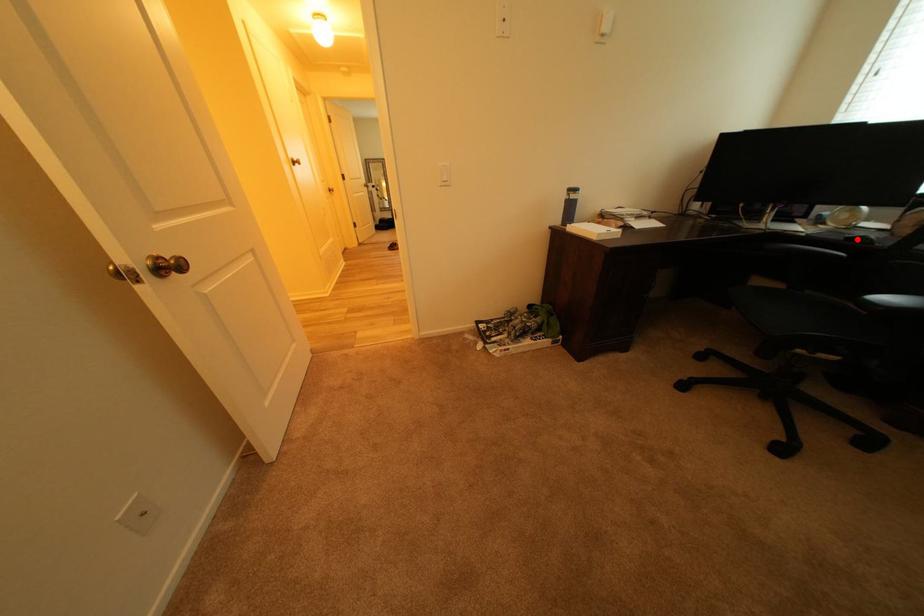
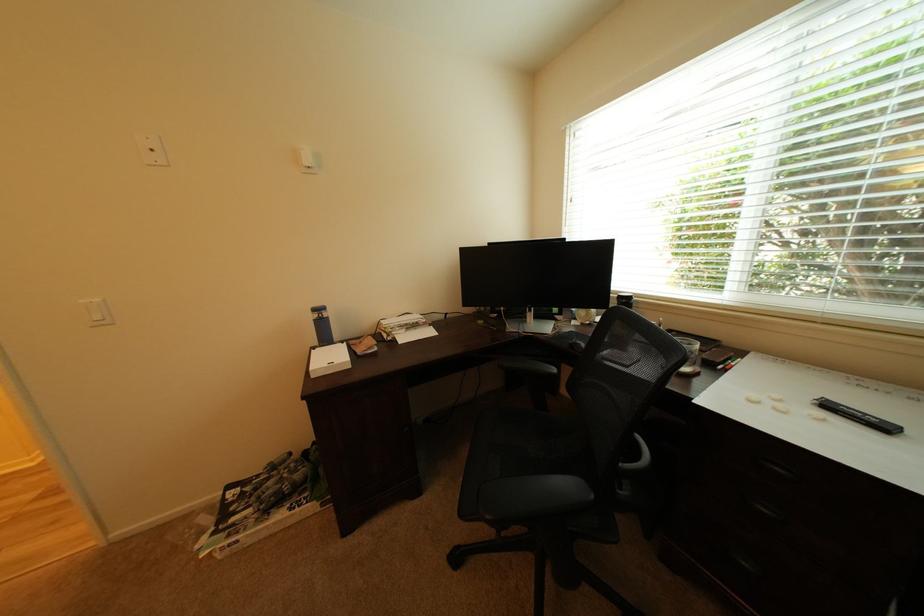
Find the pixel in the second image that matches the highlighted location in the first image.

(580, 345)